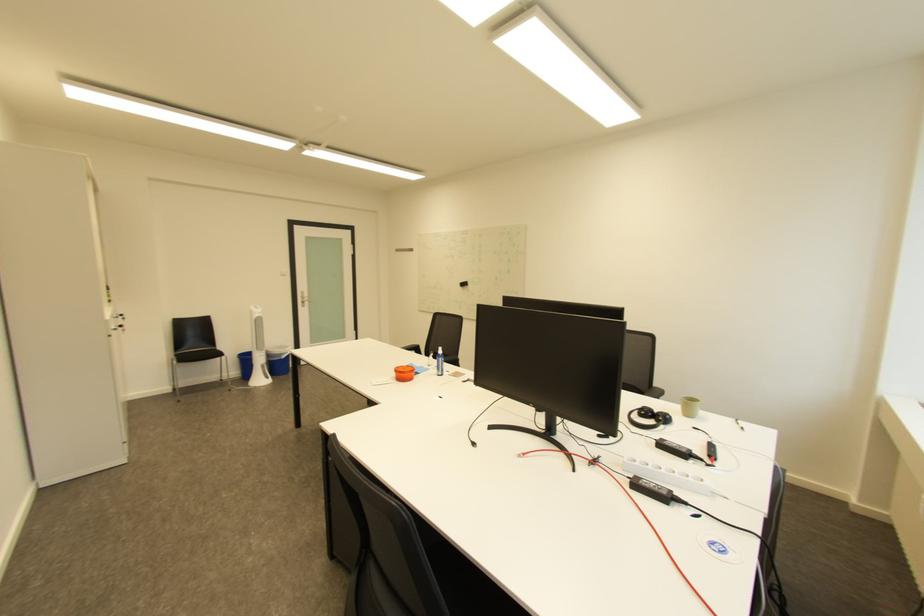
You are a GUI agent. You are given a task and a screenshot of the screen. Output one action in this format:
    pyautogui.click(x=<x>, y=<y>)
    Task: Click on the chair sitting surface
    
    Given the screenshot: What is the action you would take?
    pyautogui.click(x=197, y=354)